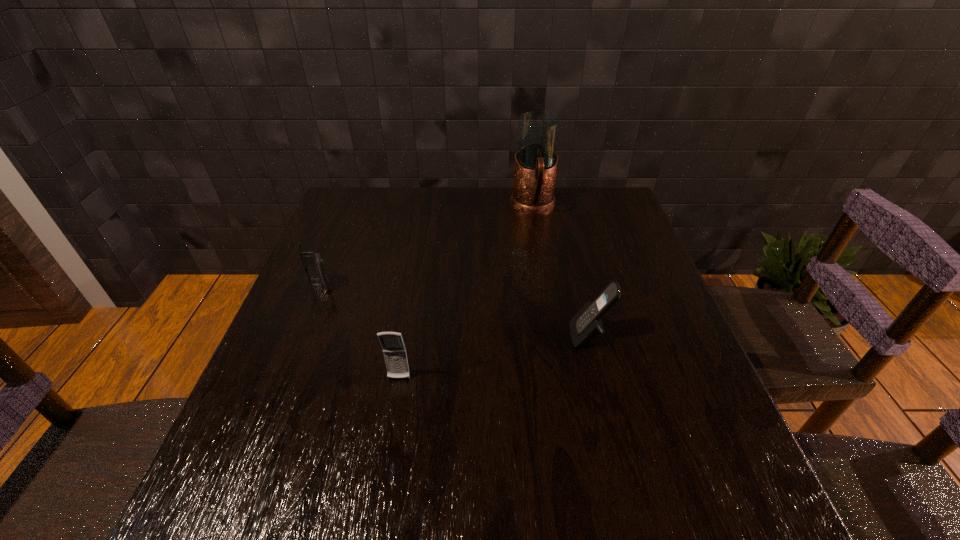
The height and width of the screenshot is (540, 960). I want to click on object that ranks as the closest to the rightmost cellular telephone, so click(394, 350).

Identify which object is located as the nearest to the nearest object. Please provide its 2D coordinates. Your answer should be formatted as a tuple, i.e. [(x, y)], where the tuple contains the x and y coordinates of a point satisfying the conditions above.

[(313, 263)]

Identify the location of the closest cellular telephone to the second cellular telephone from left to right. (313, 263).

Locate which cellular telephone is the second closest to the farthest cellular telephone. Please provide its 2D coordinates. Your answer should be formatted as a tuple, i.e. [(x, y)], where the tuple contains the x and y coordinates of a point satisfying the conditions above.

[(586, 327)]